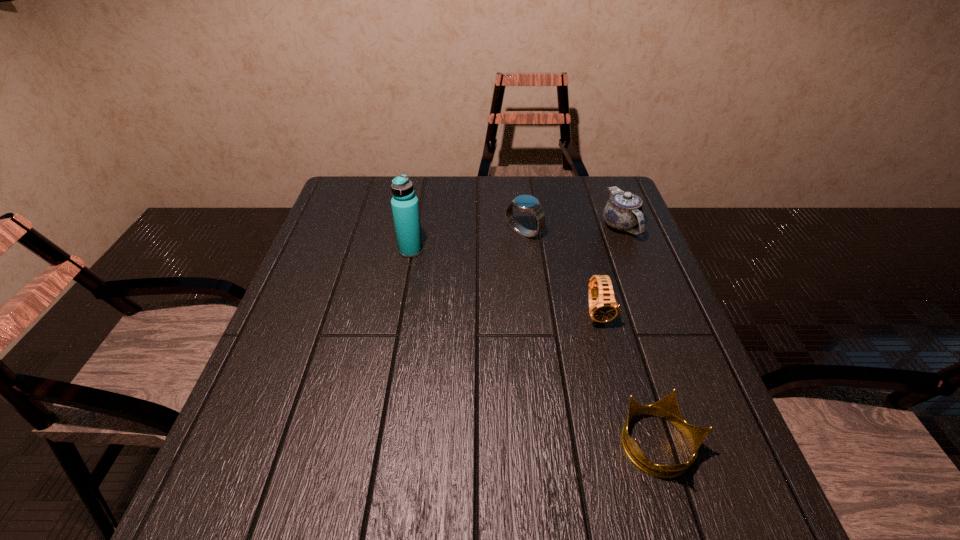
You are a GUI agent. You are given a task and a screenshot of the screen. Output one action in this format:
    pyautogui.click(x=<x>, y=<y>)
    Task: Click on the leftmost object
    This screenshot has width=960, height=540.
    Given the screenshot: What is the action you would take?
    pyautogui.click(x=405, y=208)

Where is `water bottle`? Image resolution: width=960 pixels, height=540 pixels. water bottle is located at coordinates (405, 208).

At what (x,y) coordinates should I click in order to perform the action: click on chinaware. Please return your answer as a coordinate pair (x, y). The image size is (960, 540). Looking at the image, I should click on (623, 211).

The width and height of the screenshot is (960, 540). Find the location of `the left watch`. the left watch is located at coordinates (525, 203).

Locate an element on the screen. This screenshot has width=960, height=540. the second object from left to right is located at coordinates (525, 203).

Identify the location of the nearer watch. (603, 307).

Locate an element on the screen. the right watch is located at coordinates (603, 307).

In order to click on the shortest object in this screenshot , I will do (x=667, y=408).

Locate an element on the screen. crown is located at coordinates (667, 408).

You are a GUI agent. You are given a task and a screenshot of the screen. Output one action in this format:
    pyautogui.click(x=<x>, y=<y>)
    Task: Click on the free space located on the front of the water bottle
    
    Given the screenshot: What is the action you would take?
    pyautogui.click(x=407, y=273)